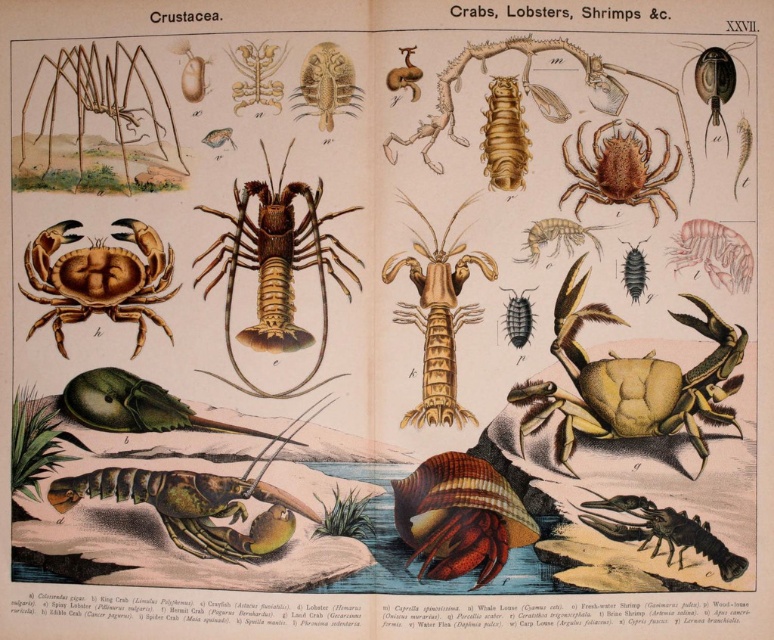
You are a marine biologist examining the illustration of crustaceans. You need to identify which of the two crabs at the center has a smaller size. The two crabs are the shiny brown hermit crab at center and the matte brown crab at center. Which one is smaller?

The shiny brown hermit crab at center has a lesser height compared to the matte brown crab at center, so the shiny brown hermit crab at center is smaller.

Looking at this image, you are a student examining the scientific illustration of crustaceans. You notice the brown matte spider at upper center and the brown textured crab at upper right. Which one appears to be in front of the other?

The brown matte spider at upper center is closer to the viewer than the brown textured crab at upper right, so it appears in front of the brown textured crab at upper right.